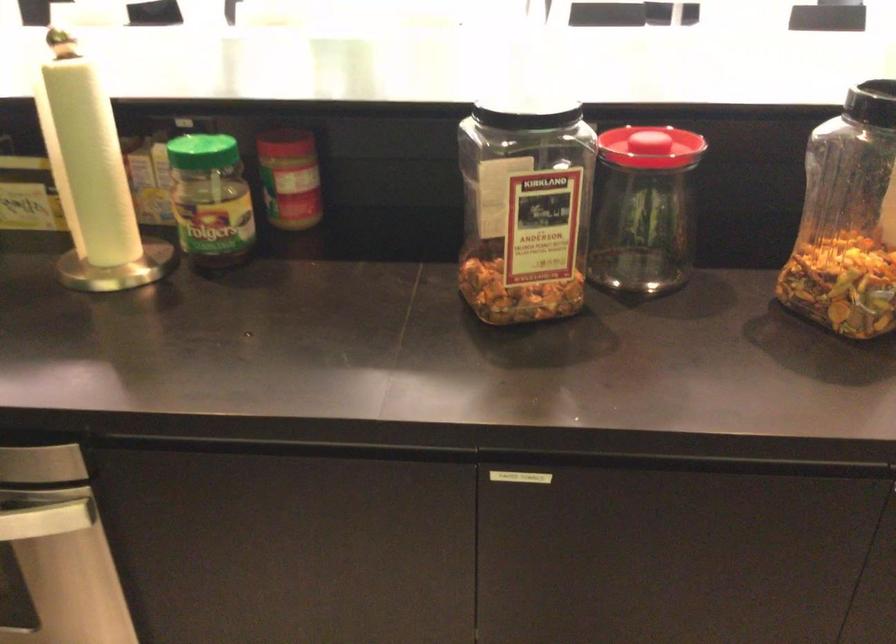
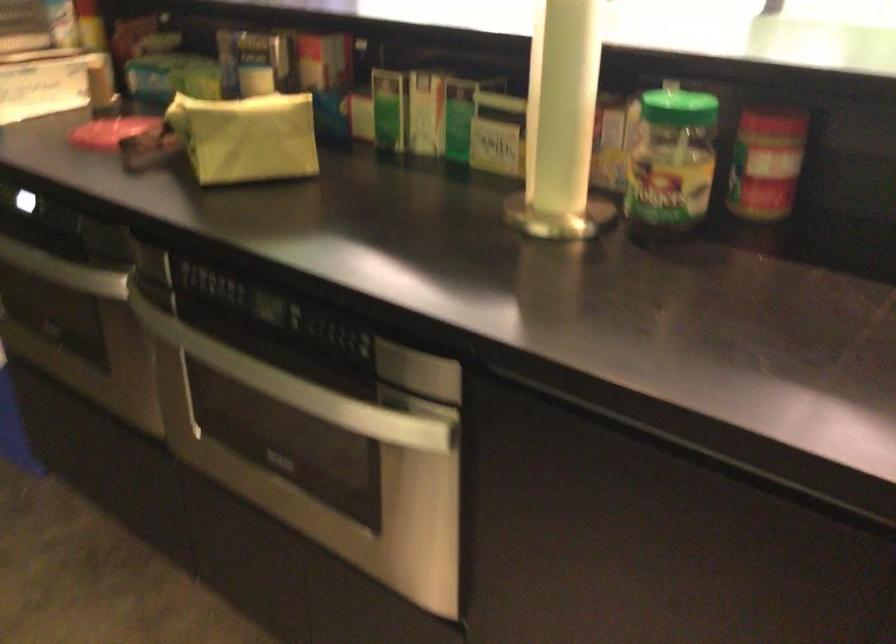
In the second image, find the point that corresponds to (x=287, y=136) in the first image.

(773, 116)